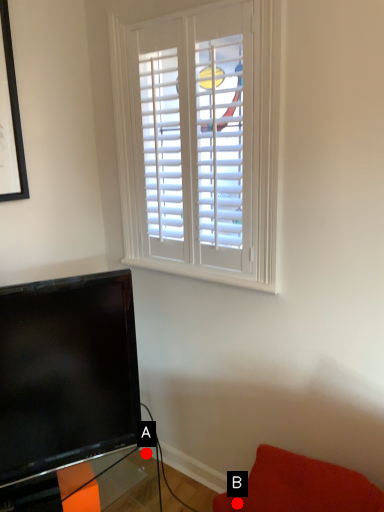
Question: Two points are circled on the image, labeled by A and B beside each circle. Which point appears closest to the camera in this image?

Choices:
 (A) A is closer
 (B) B is closer

Answer: (B)